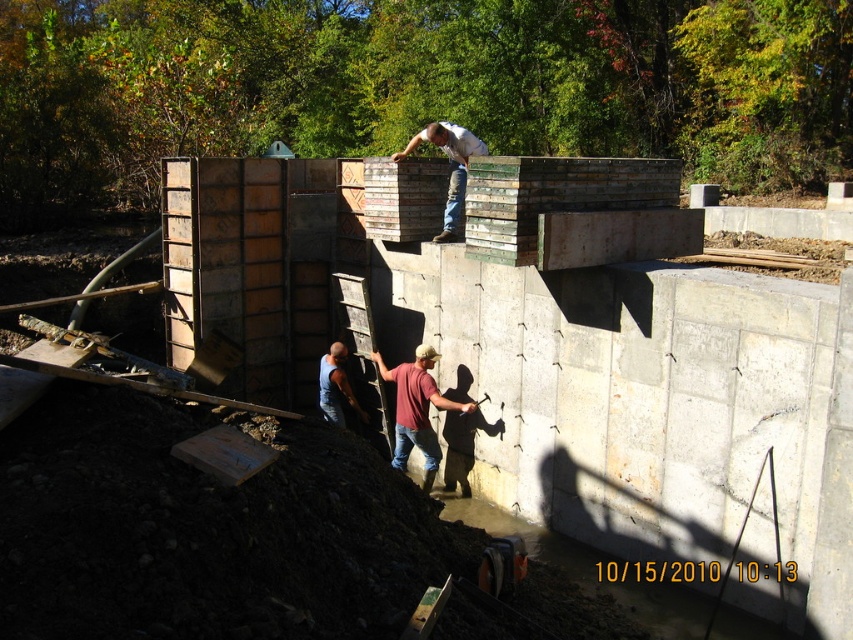
You are a safety inspector observing the construction site. You notice the maroon shirt at lower center and the matte concrete block at upper center. Which object is shorter in height?

The maroon shirt at lower center has a lesser height compared to the matte concrete block at upper center, so the maroon shirt at lower center is shorter.

You are a safety inspector observing the construction site. You notice the maroon shirt at lower center and the matte concrete block at upper center. Which object is located to the left of the other?

The maroon shirt at lower center is positioned on the left side of matte concrete block at upper center.

You are a construction worker standing at the edge of the site and need to place a tool on the nearest object. Which object between the matte concrete block at upper center and the blue denim jeans at lower center should you choose?

The matte concrete block at upper center is closer to the viewer than the blue denim jeans at lower center, so you should place the tool on the matte concrete block at upper center.